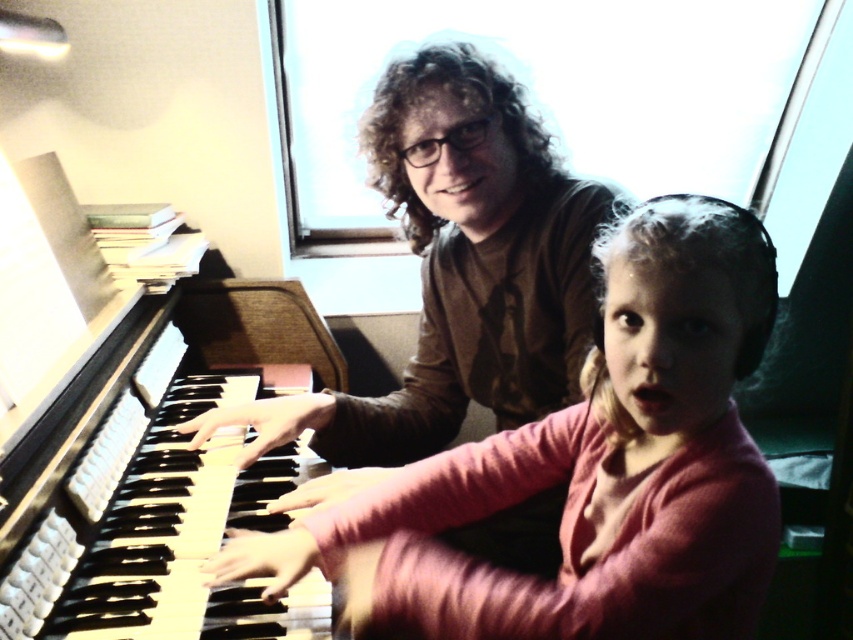
You are a student sitting in front of the piano. You need to place a music stand between the wooden piano keys at left and the matte brown shirt at upper center so that it doesn t block your view of the teacher s hands. Where should you position the music stand?

The wooden piano keys at left has a lesser height compared to matte brown shirt at upper center. To avoid blocking your view of the teacher s hands, position the music stand between them at a height lower than the matte brown shirt at upper center but higher than the wooden piano keys at left.

You are a photographer setting up a shoot in the room with the piano. You need to ensure that both the pink matte shirt at center and the matte brown shirt at upper center are visible in the frame. Based on their positions, which shirt should you focus on to make sure both are in focus?

The pink matte shirt at center is in front of the matte brown shirt at upper center, so focusing on the pink matte shirt at center will ensure both are in focus as the matte brown shirt at upper center is behind it.